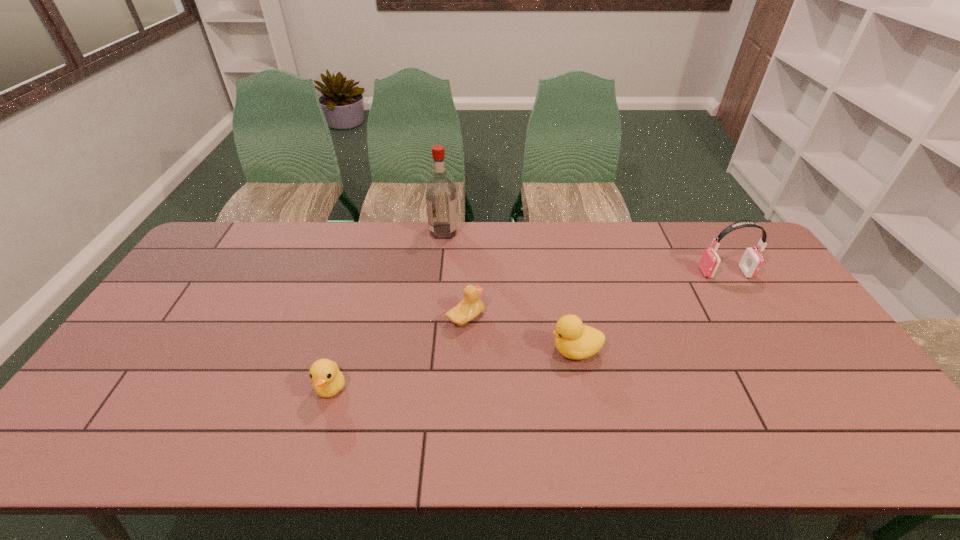
Find the location of `object located in the right edge section of the desktop`. object located in the right edge section of the desktop is located at coordinates (751, 262).

In the image, there is a desktop. Where is `vacant space at the far edge`? The height and width of the screenshot is (540, 960). vacant space at the far edge is located at coordinates (600, 225).

You are a GUI agent. You are given a task and a screenshot of the screen. Output one action in this format:
    pyautogui.click(x=<x>, y=<y>)
    Task: Click on the vacant space at the near edge of the desktop
    The image size is (960, 540).
    Given the screenshot: What is the action you would take?
    pyautogui.click(x=156, y=451)

At what (x,y) coordinates should I click in order to perform the action: click on vacant point at the left edge. Please return your answer as a coordinate pair (x, y). The width and height of the screenshot is (960, 540). Looking at the image, I should click on (197, 323).

This screenshot has height=540, width=960. I want to click on free space at the right edge of the desktop, so click(791, 357).

Find the location of a particular element. This screenshot has width=960, height=540. free region at the far left corner is located at coordinates (252, 229).

I want to click on free space between the tallest object and the second nearest object, so click(510, 291).

Where is `vacant area that lies between the second farthest object and the tallest object`? vacant area that lies between the second farthest object and the tallest object is located at coordinates (585, 252).

You are a GUI agent. You are given a task and a screenshot of the screen. Output one action in this format:
    pyautogui.click(x=<x>, y=<y>)
    Task: Click on the vacant space in between the nearest object and the earphone
    This screenshot has width=960, height=540.
    Given the screenshot: What is the action you would take?
    pyautogui.click(x=528, y=330)

Locate an element on the screen. free spot between the second nearest object and the third farthest object is located at coordinates (520, 334).